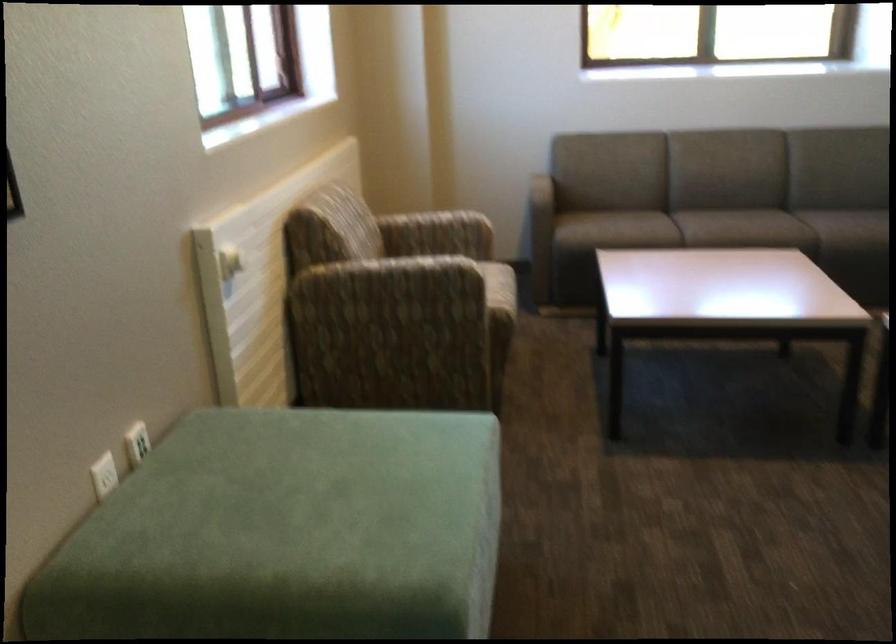
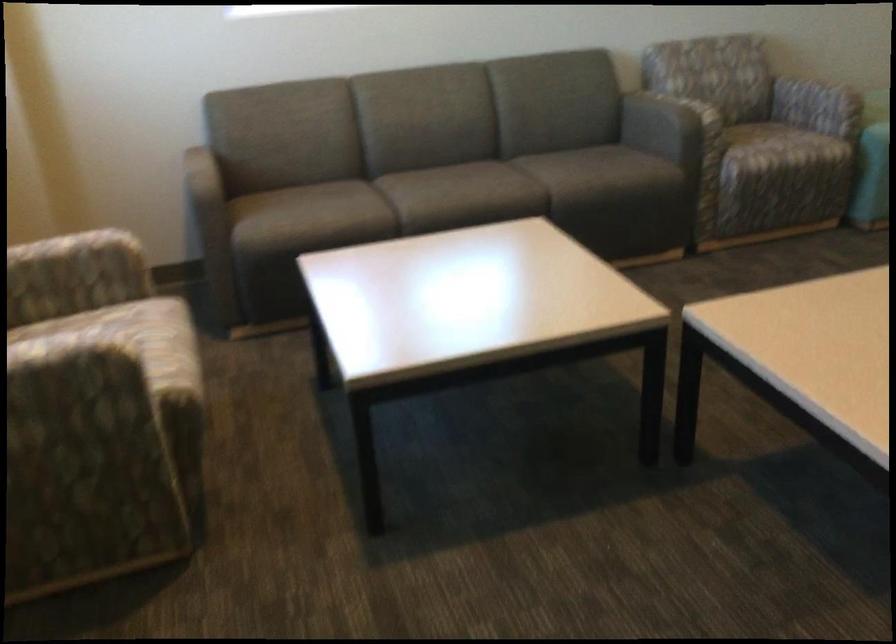
Question: In a continuous first-person perspective shot, in which direction is the camera moving?

Choices:
 (A) Left
 (B) Right
 (C) Forward
 (D) Backward

Answer: (C)